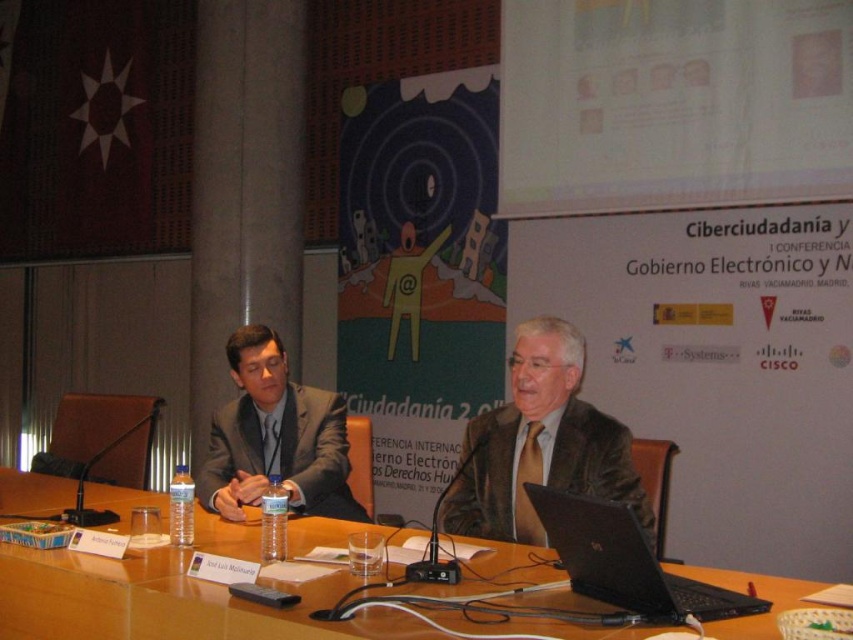
Question: Is wooden table at center to the left of gray concrete pillar at center from the viewer's perspective?

Choices:
 (A) no
 (B) yes

Answer: (A)

Question: Which point is closer to the camera?

Choices:
 (A) matte black suit at center
 (B) wooden table at center

Answer: (B)

Question: Among these points, which one is farthest from the camera?

Choices:
 (A) (212, 284)
 (B) (498, 417)
 (C) (535, 497)

Answer: (A)

Question: Estimate the real-world distances between objects in this image. Which object is closer to the gray concrete pillar at center?

Choices:
 (A) black plastic laptop at center
 (B) brown leather jacket at center
 (C) wooden table at center
 (D) matte black suit at center

Answer: (D)

Question: Does matte black suit at center have a smaller size compared to black plastic laptop at center?

Choices:
 (A) yes
 (B) no

Answer: (B)

Question: Can you confirm if gray concrete pillar at center is positioned below brown leather jacket at center?

Choices:
 (A) yes
 (B) no

Answer: (B)